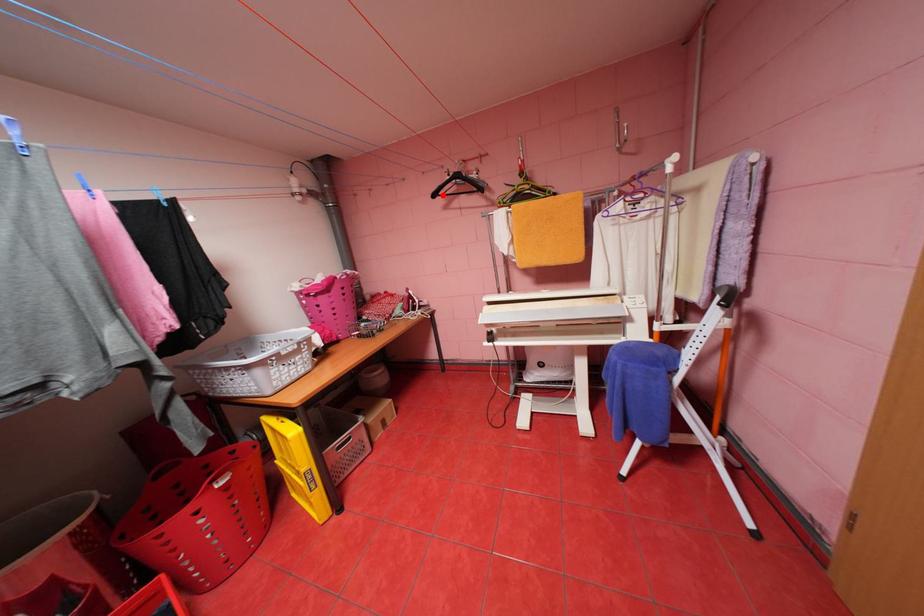
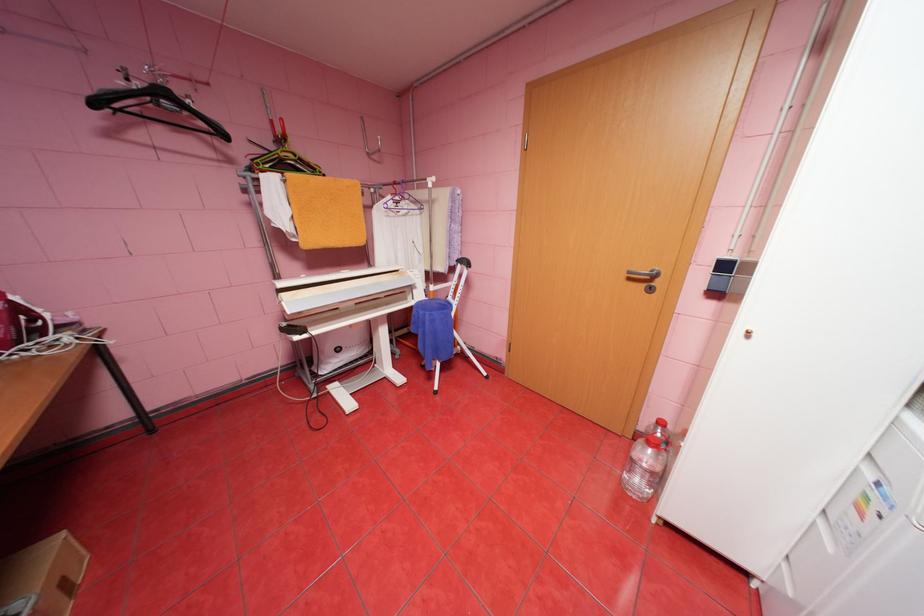
The point at the highlighted location is marked in the first image. Where is the corresponding point in the second image?

(103, 103)